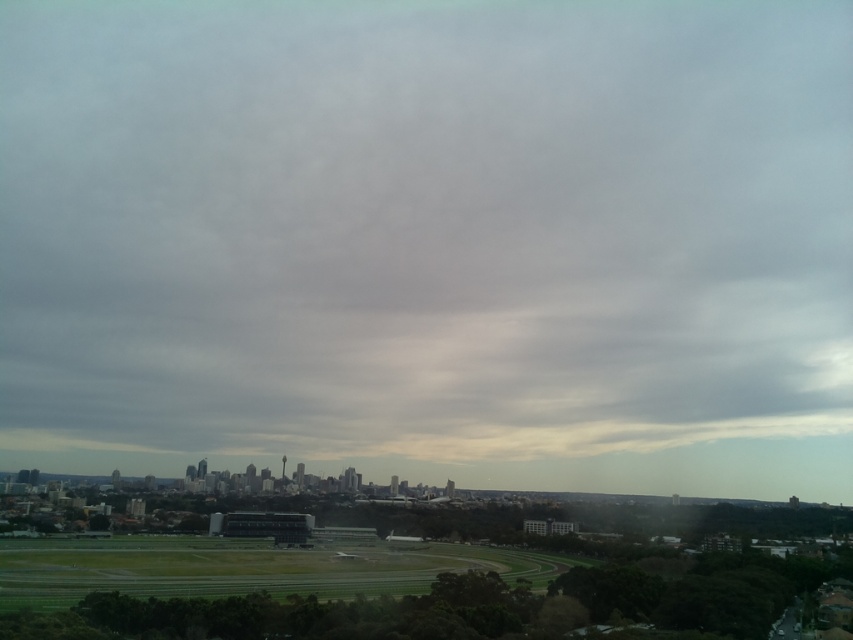
You are a drone operator who needs to fly a drone from the gray fluffy cloud at upper center to the green grass football field at lower left. Given that the drone has a maximum flight range of 250 meters, will it be able to reach the destination without recharging?

The distance between the gray fluffy cloud at upper center and the green grass football field at lower left is 254.81 meters, which exceeds the drone operator drone maximum flight range of 250 meters. The drone will not be able to reach the destination without recharging.

You are a photographer standing at the edge of the sports field or park in the cityscape image. You want to capture a photo of the gray fluffy cloud at upper center. If your camera has a focal length of 50mm, will the cloud fill the frame adequately? Assume the human eye has an average field of view of about 45 degrees and the camera sensor size is standard.

The gray fluffy cloud at upper center and camera are 633.22 meters apart. At 50mm focal length, the field of view would be too narrow to adequately fill the frame with the cloud unless it is very large. However, without knowing the cloud size, it is hard to determine precisely. But given the distance, it might appear small in the photo.